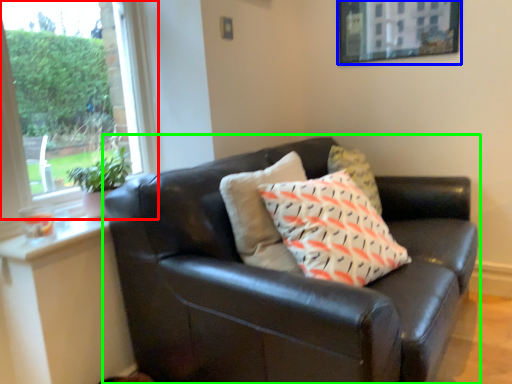
Question: Which is farther away from window (highlighted by a red box)? picture frame (highlighted by a blue box) or studio couch (highlighted by a green box)?

Choices:
 (A) picture frame
 (B) studio couch

Answer: (A)